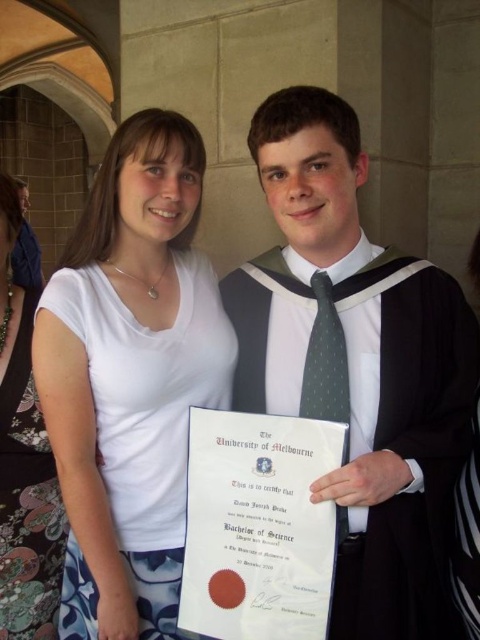
You are a photographer at a graduation ceremony and need to ensure that both the matte black graduation gown at center and the green dotted fabric tie at center are clearly visible in the photo. Based on their positions, which one is closer to the right edge of the frame?

The matte black graduation gown at center is positioned on the right side of green dotted fabric tie at center, so it is closer to the right edge of the frame.